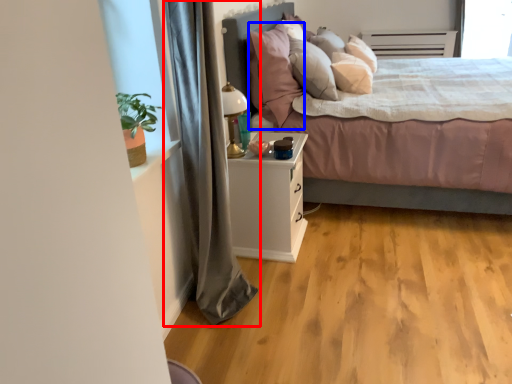
Question: Which object appears closest to the camera in this image, curtain (highlighted by a red box) or pillow (highlighted by a blue box)?

Choices:
 (A) curtain
 (B) pillow

Answer: (A)